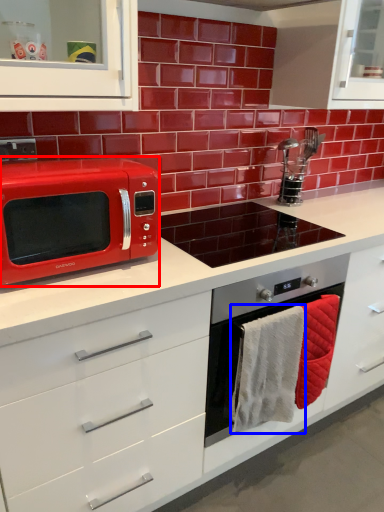
Question: Which point is further to the camera, microwave oven (highlighted by a red box) or hand towel (highlighted by a blue box)?

Choices:
 (A) microwave oven
 (B) hand towel

Answer: (B)